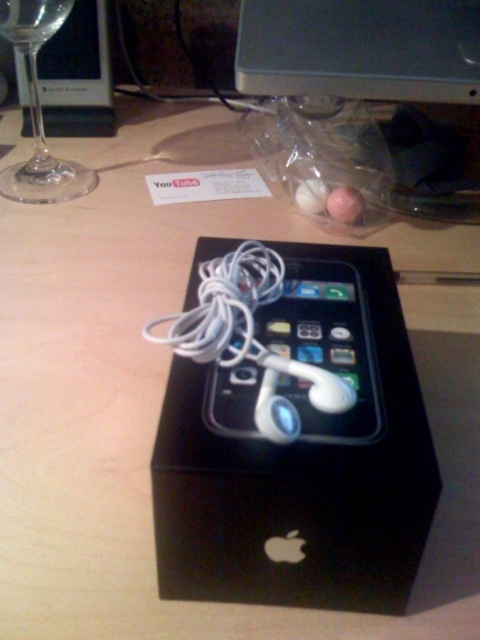
Question: Can you confirm if black matte box at center is bigger than transparent glass at left?

Choices:
 (A) yes
 (B) no

Answer: (B)

Question: Which object appears closest to the camera in this image?

Choices:
 (A) black matte box at center
 (B) transparent glass at left

Answer: (A)

Question: Which point is closer to the camera?

Choices:
 (A) white glossy earphones at center
 (B) metallic silver computer at upper center
 (C) black matte box at center
 (D) transparent glass at left

Answer: (C)

Question: Is metallic silver computer at upper center wider than white glossy earphones at center?

Choices:
 (A) no
 (B) yes

Answer: (B)

Question: Is metallic silver computer at upper center bigger than white glossy earphones at center?

Choices:
 (A) yes
 (B) no

Answer: (A)

Question: Among these objects, which one is farthest from the camera?

Choices:
 (A) black matte box at center
 (B) transparent glass at left

Answer: (B)